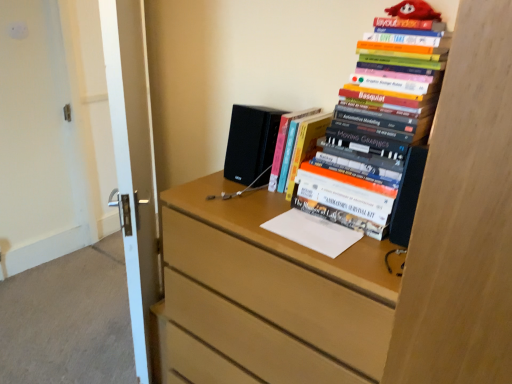
Image resolution: width=512 pixels, height=384 pixels. I want to click on vacant area on top of light wood chest of drawers at center (from a real-world perspective), so click(283, 216).